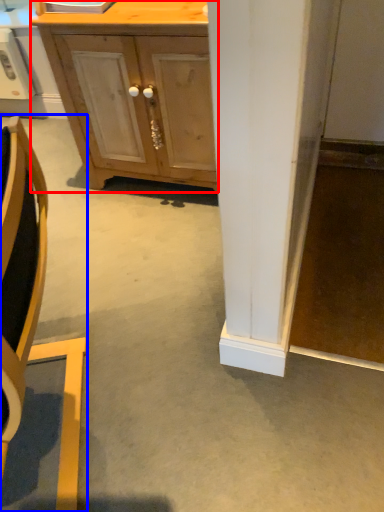
Question: Which of the following is the closest to the observer, cabinetry (highlighted by a red box) or chair (highlighted by a blue box)?

Choices:
 (A) cabinetry
 (B) chair

Answer: (B)